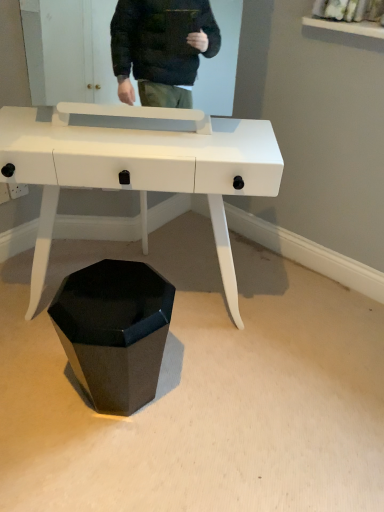
I want to click on free area in between white glossy desk at center and glossy black hexagonal at lower center, so click(x=136, y=382).